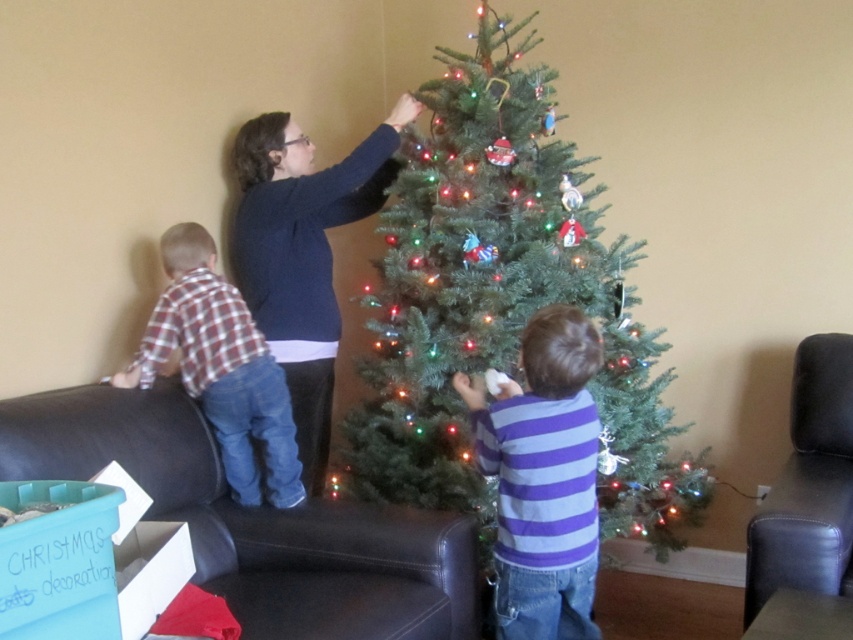
Which of these two, green matte christmas tree at center or plaid fabric shirt at left, stands taller?

With more height is green matte christmas tree at center.

Which is more to the left, green matte christmas tree at center or plaid fabric shirt at left?

plaid fabric shirt at left

Who is more distant from viewer, (413, 214) or (225, 397)?

The point (413, 214) is behind.

At what (x,y) coordinates should I click in order to perform the action: click on green matte christmas tree at center. Please return your answer as a coordinate pair (x, y). Looking at the image, I should click on (503, 300).

In the scene shown: Which is below, green matte christmas tree at center or purple striped shirt at center?

purple striped shirt at center

Does green matte christmas tree at center have a smaller size compared to purple striped shirt at center?

No, green matte christmas tree at center is not smaller than purple striped shirt at center.

Is point (585, 282) positioned after point (488, 458)?

Yes, point (585, 282) is farther from viewer.

This screenshot has height=640, width=853. What are the coordinates of `green matte christmas tree at center` in the screenshot? It's located at (503, 300).

Is green matte christmas tree at center closer to the viewer compared to dark blue sweater at upper center?

Yes, it is in front of dark blue sweater at upper center.

Can you confirm if green matte christmas tree at center is positioned below dark blue sweater at upper center?

Correct, green matte christmas tree at center is located below dark blue sweater at upper center.

This screenshot has height=640, width=853. Describe the element at coordinates (503, 300) in the screenshot. I see `green matte christmas tree at center` at that location.

This screenshot has height=640, width=853. I want to click on green matte christmas tree at center, so click(503, 300).